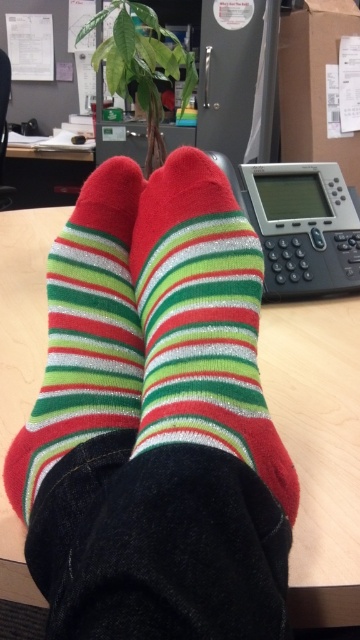
Question: Is shiny red socks at center to the left of shiny red-green-striped socks at center from the viewer's perspective?

Choices:
 (A) no
 (B) yes

Answer: (A)

Question: Which object appears farthest from the camera in this image?

Choices:
 (A) shiny red socks at center
 (B) shiny red-green-striped socks at center

Answer: (B)

Question: Based on their relative distances, which object is nearer to the shiny red socks at center?

Choices:
 (A) shiny red-green-striped socks at center
 (B) wooden table at center

Answer: (A)

Question: Can you confirm if wooden table at center is smaller than shiny red-green-striped socks at center?

Choices:
 (A) no
 (B) yes

Answer: (A)

Question: Estimate the real-world distances between objects in this image. Which object is closer to the shiny red socks at center?

Choices:
 (A) shiny red-green-striped socks at center
 (B) wooden table at center

Answer: (A)

Question: Can you confirm if wooden table at center is positioned above shiny red-green-striped socks at center?

Choices:
 (A) no
 (B) yes

Answer: (B)